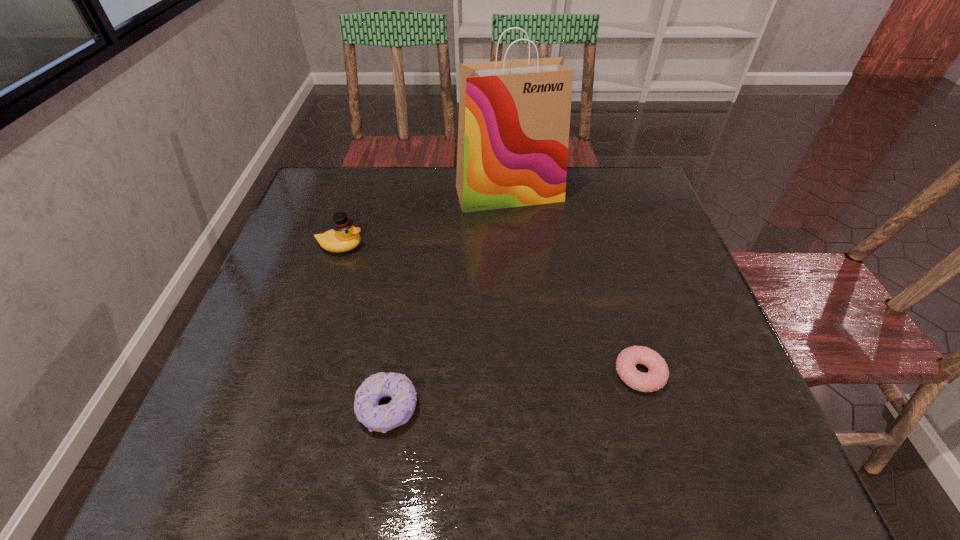
What are the coordinates of `free space located on the left of the left doughnut` in the screenshot? It's located at [x=309, y=409].

Locate an element on the screen. The image size is (960, 540). blank space located on the back of the rightmost object is located at coordinates (614, 288).

What are the coordinates of `object present at the far edge` in the screenshot? It's located at (514, 116).

This screenshot has width=960, height=540. I want to click on object that is positioned at the near edge, so click(381, 418).

What are the coordinates of `object that is positioned at the left edge` in the screenshot? It's located at (343, 236).

Locate an element on the screen. Image resolution: width=960 pixels, height=540 pixels. object at the right edge is located at coordinates (656, 378).

This screenshot has width=960, height=540. Identify the location of vacant space at the far edge. (445, 177).

Identify the location of blank space at the near edge of the desktop. This screenshot has height=540, width=960. (412, 468).

This screenshot has width=960, height=540. What are the coordinates of `vacant space at the left edge of the desktop` in the screenshot? It's located at coord(252,342).

In the image, there is a desktop. At what (x,y) coordinates should I click in order to perform the action: click on vacant area at the far left corner. Please return your answer as a coordinate pair (x, y). Looking at the image, I should click on (330, 192).